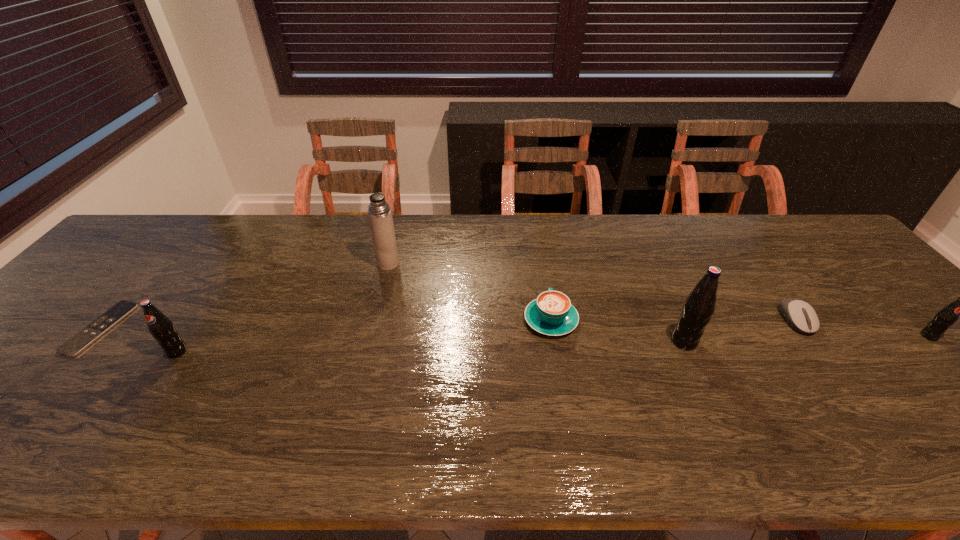
This screenshot has height=540, width=960. I want to click on vacant space located with the handle on the right side of the fourth object from right to left, so click(545, 289).

Where is `free space located on the right of the farthest object`? free space located on the right of the farthest object is located at coordinates (481, 264).

This screenshot has height=540, width=960. I want to click on blank area located 0.140m on the wheel side of the second shortest object, so click(843, 384).

The height and width of the screenshot is (540, 960). In order to click on object located at the far edge in this screenshot , I will do `click(379, 213)`.

The height and width of the screenshot is (540, 960). Find the location of `object that is at the left edge`. object that is at the left edge is located at coordinates (84, 338).

Identify the location of object present at the right edge. point(946,317).

Locate an element on the screen. The height and width of the screenshot is (540, 960). free region at the far edge of the desktop is located at coordinates (667, 247).

You are a GUI agent. You are given a task and a screenshot of the screen. Output one action in this format:
    pyautogui.click(x=<x>, y=<y>)
    Task: Click on the vacant position at the near edge of the desktop
    The image size is (960, 540).
    Given the screenshot: What is the action you would take?
    pyautogui.click(x=660, y=413)

Locate an element on the screen. The width and height of the screenshot is (960, 540). vacant space at the left edge of the desktop is located at coordinates tap(27, 359).

Where is `free space at the right edge of the desktop`? free space at the right edge of the desktop is located at coordinates (907, 357).